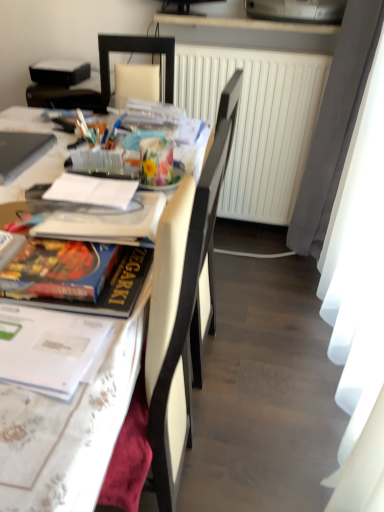
Question: From a real-world perspective, is white glossy table at left on white matte radiator at center?

Choices:
 (A) no
 (B) yes

Answer: (A)

Question: Is white matte radiator at center completely or partially inside white glossy table at left?

Choices:
 (A) no
 (B) yes

Answer: (A)

Question: Is white glossy table at left shorter than white matte radiator at center?

Choices:
 (A) yes
 (B) no

Answer: (B)

Question: Is white glossy table at left outside of white matte radiator at center?

Choices:
 (A) yes
 (B) no

Answer: (A)

Question: Does white glossy table at left have a smaller size compared to white matte radiator at center?

Choices:
 (A) no
 (B) yes

Answer: (A)

Question: From the image's perspective, is metallic silver printer at upper center located above or below matte board game at left, positioned as the 2th magazine in front-to-back order?

Choices:
 (A) above
 (B) below

Answer: (A)

Question: Considering their positions, is metallic silver printer at upper center located in front of or behind matte board game at left, which is the second magazine from top to bottom?

Choices:
 (A) front
 (B) behind

Answer: (B)

Question: Is metallic silver printer at upper center spatially inside matte board game at left, which is the second magazine from top to bottom, or outside of it?

Choices:
 (A) inside
 (B) outside

Answer: (B)

Question: In terms of size, does metallic silver printer at upper center appear bigger or smaller than matte board game at left, the second magazine ordered from the bottom?

Choices:
 (A) big
 (B) small

Answer: (A)

Question: Considering the relative positions of white matte radiator at center and white leather chair at center in the image provided, is white matte radiator at center to the left or to the right of white leather chair at center?

Choices:
 (A) left
 (B) right

Answer: (B)

Question: Would you say white matte radiator at center is inside or outside white leather chair at center?

Choices:
 (A) outside
 (B) inside

Answer: (A)

Question: From a real-world perspective, is white matte radiator at center physically located above or below white leather chair at center?

Choices:
 (A) below
 (B) above

Answer: (B)

Question: From the image's perspective, is white matte radiator at center located above or below white leather chair at center?

Choices:
 (A) below
 (B) above

Answer: (B)

Question: From a real-world perspective, is white paper at center positioned above or below matte silver laptop at upper left?

Choices:
 (A) above
 (B) below

Answer: (A)

Question: Which is correct: white paper at center is inside matte silver laptop at upper left, or outside of it?

Choices:
 (A) outside
 (B) inside

Answer: (A)